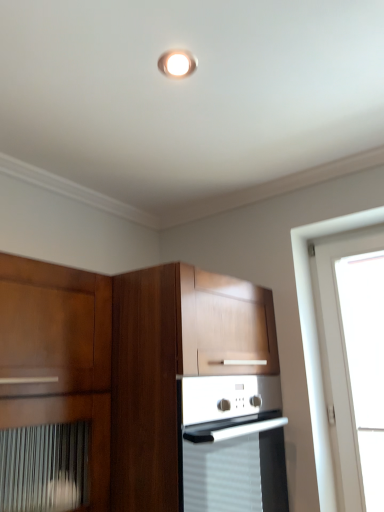
Question: From the image's perspective, is wooden cabinet at center on top of matte white light fixture at upper center?

Choices:
 (A) yes
 (B) no

Answer: (B)

Question: From a real-world perspective, is wooden cabinet at center located higher than matte white light fixture at upper center?

Choices:
 (A) no
 (B) yes

Answer: (A)

Question: From a real-world perspective, is wooden cabinet at center beneath matte white light fixture at upper center?

Choices:
 (A) no
 (B) yes

Answer: (B)

Question: Is wooden cabinet at center outside of matte white light fixture at upper center?

Choices:
 (A) yes
 (B) no

Answer: (A)

Question: Is wooden cabinet at center positioned behind matte white light fixture at upper center?

Choices:
 (A) no
 (B) yes

Answer: (A)

Question: Does wooden cabinet at center turn towards matte white light fixture at upper center?

Choices:
 (A) yes
 (B) no

Answer: (B)

Question: Does matte white light fixture at upper center appear on the left side of wooden cabinet at center?

Choices:
 (A) yes
 (B) no

Answer: (B)

Question: Considering the relative sizes of matte white light fixture at upper center and wooden cabinet at center in the image provided, is matte white light fixture at upper center smaller than wooden cabinet at center?

Choices:
 (A) no
 (B) yes

Answer: (B)

Question: From a real-world perspective, does matte white light fixture at upper center sit lower than wooden cabinet at center?

Choices:
 (A) yes
 (B) no

Answer: (B)

Question: Is matte white light fixture at upper center thinner than wooden cabinet at center?

Choices:
 (A) no
 (B) yes

Answer: (B)

Question: Is matte white light fixture at upper center in contact with wooden cabinet at center?

Choices:
 (A) yes
 (B) no

Answer: (B)

Question: Is matte white light fixture at upper center turned away from wooden cabinet at center?

Choices:
 (A) yes
 (B) no

Answer: (B)

Question: From the image's perspective, relative to wooden cabinet at center, is matte white light fixture at upper center above or below?

Choices:
 (A) above
 (B) below

Answer: (A)